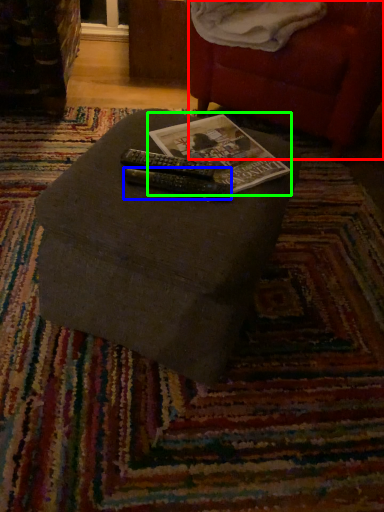
Question: Which object is positioned farthest from bean bag chair (highlighted by a red box)? Select from remote (highlighted by a blue box) and paperback book (highlighted by a green box).

Choices:
 (A) remote
 (B) paperback book

Answer: (A)